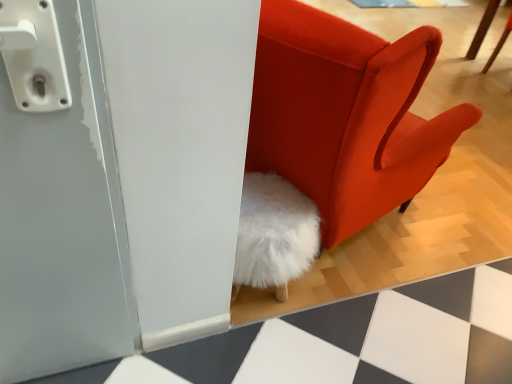
Question: Which is correct: white fluffy chair at upper right is inside velvet orange chair at center, or outside of it?

Choices:
 (A) inside
 (B) outside

Answer: (B)

Question: From a real-world perspective, relative to velvet orange chair at center, is white fluffy chair at upper right vertically above or below?

Choices:
 (A) below
 (B) above

Answer: (A)

Question: Is white fluffy chair at upper right to the left or to the right of velvet orange chair at center in the image?

Choices:
 (A) left
 (B) right

Answer: (B)

Question: From the image's perspective, is velvet orange chair at center positioned above or below white fluffy chair at upper right?

Choices:
 (A) below
 (B) above

Answer: (A)

Question: Considering the positions of velvet orange chair at center and white fluffy chair at upper right in the image, is velvet orange chair at center wider or thinner than white fluffy chair at upper right?

Choices:
 (A) thin
 (B) wide

Answer: (B)

Question: Considering the positions of velvet orange chair at center and white fluffy chair at upper right in the image, is velvet orange chair at center taller or shorter than white fluffy chair at upper right?

Choices:
 (A) short
 (B) tall

Answer: (B)

Question: Considering the positions of point (320, 69) and point (468, 49), is point (320, 69) closer or farther from the camera than point (468, 49)?

Choices:
 (A) closer
 (B) farther

Answer: (A)